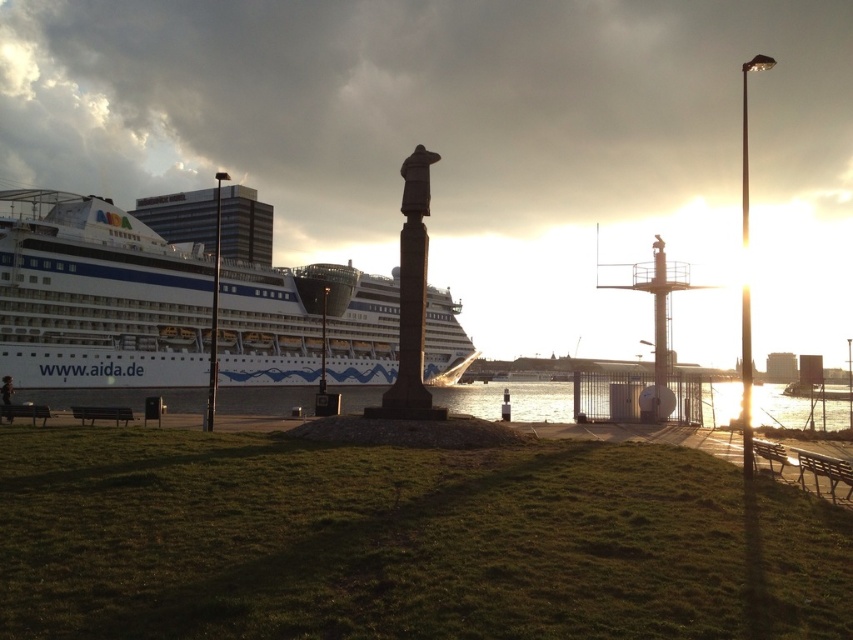
Question: Does brown wooden bench at lower left lie behind wooden bench at lower left?

Choices:
 (A) yes
 (B) no

Answer: (B)

Question: Does white glossy cruise ship at left have a greater width compared to wooden park bench at lower right?

Choices:
 (A) yes
 (B) no

Answer: (A)

Question: Is brown wooden bench at lower left positioned behind wooden bench at lower left?

Choices:
 (A) no
 (B) yes

Answer: (A)

Question: Among these points, which one is nearest to the camera?

Choices:
 (A) (670, 500)
 (B) (820, 465)

Answer: (A)

Question: Among these objects, which one is nearest to the camera?

Choices:
 (A) green grassy at center
 (B) white glossy cruise ship at left
 (C) wooden bench at lower left
 (D) brown wooden bench at lower right

Answer: (A)

Question: Which object is positioned closest to the wooden bench at lower left?

Choices:
 (A) green grassy at center
 (B) wooden park bench at lower right
 (C) brown wooden bench at lower left
 (D) glistening water at center

Answer: (C)